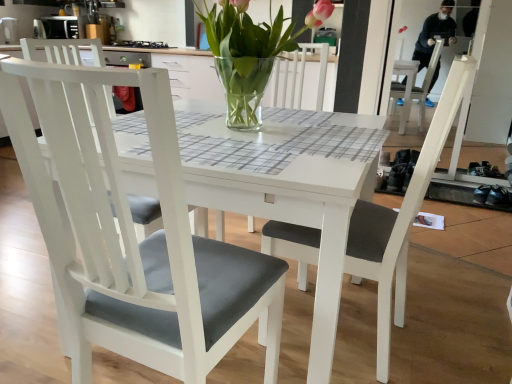
Question: Is matte gray cushioned chair at center, acting as the second chair starting from the left, spatially inside white matte chair at left, which is the 1th chair in left-to-right order, or outside of it?

Choices:
 (A) inside
 (B) outside

Answer: (A)

Question: Is matte gray cushioned chair at center, arranged as the first chair when viewed from the right, to the left or to the right of white matte chair at left, the second chair when ordered from right to left, in the image?

Choices:
 (A) left
 (B) right

Answer: (B)

Question: Which is nearer to the matte gray cushioned chair at center, arranged as the first chair when viewed from the right?

Choices:
 (A) white matte chair at left, which is the 1th chair in left-to-right order
 (B) clear glass vase at center

Answer: (A)

Question: Which object is the closest to the clear glass vase at center?

Choices:
 (A) matte gray cushioned chair at center, acting as the second chair starting from the left
 (B) white matte chair at left, which is the 1th chair in left-to-right order

Answer: (A)